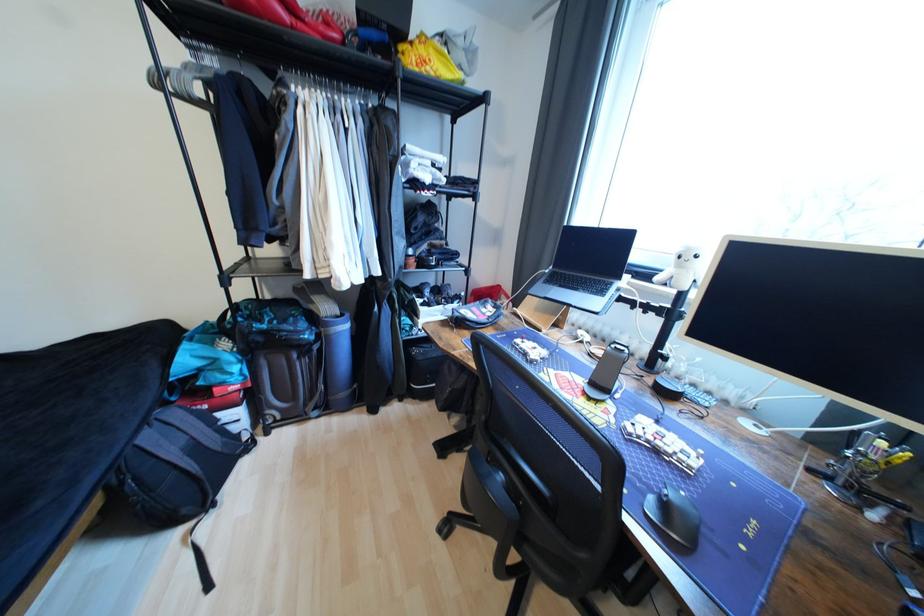
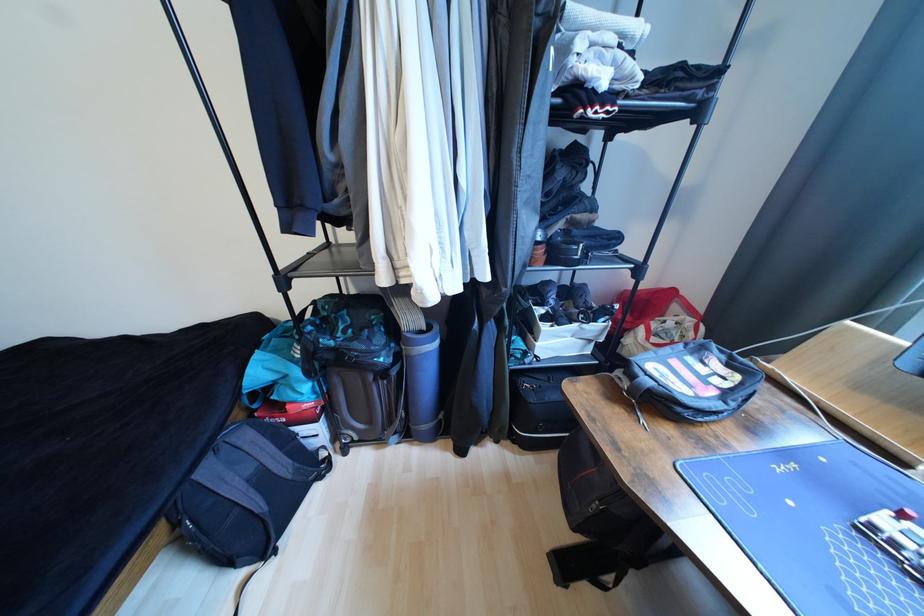
The point at (x=155, y=439) is marked in the first image. Where is the corresponding point in the second image?

(215, 472)